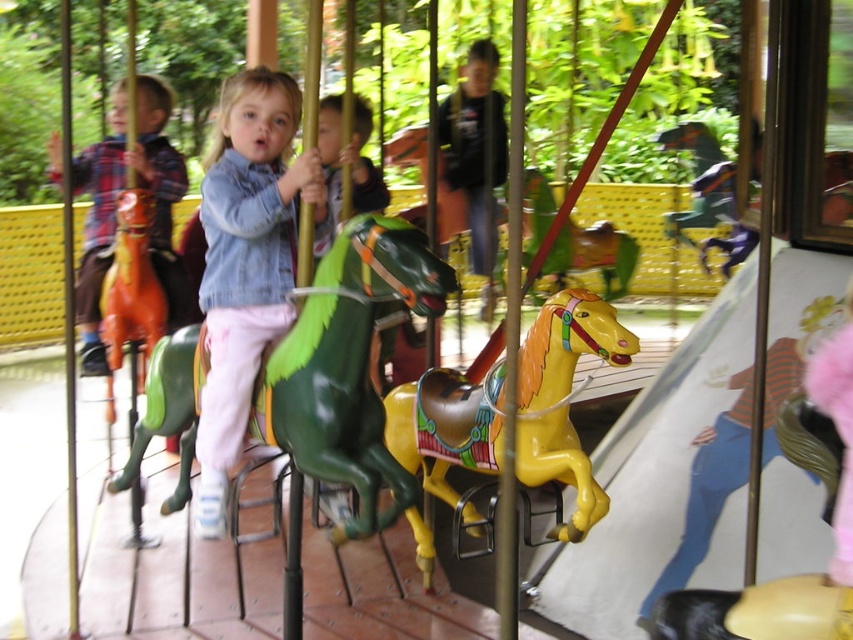
Between green glossy horse at center and matte plaid shirt at left, which one appears on the left side from the viewer's perspective?

From the viewer's perspective, matte plaid shirt at left appears more on the left side.

Based on the photo, who is higher up, green glossy horse at center or matte plaid shirt at left?

Positioned higher is matte plaid shirt at left.

Find the location of `green glossy horse at center`. green glossy horse at center is located at coordinates click(x=350, y=368).

Does matte plaid shirt at left appear over matte orange horse at left?

Indeed, matte plaid shirt at left is positioned over matte orange horse at left.

Who is more distant from viewer, (57, 156) or (132, 339)?

The point (57, 156) is more distant.

Where is `matte plaid shirt at left`? The height and width of the screenshot is (640, 853). matte plaid shirt at left is located at coordinates (114, 209).

Is shiny yellow horse at center bigger than matte orange horse at left?

Correct, shiny yellow horse at center is larger in size than matte orange horse at left.

Looking at this image, does shiny yellow horse at center appear over matte orange horse at left?

Incorrect, shiny yellow horse at center is not positioned above matte orange horse at left.

Where is `shiny yellow horse at center`? shiny yellow horse at center is located at coordinates (563, 397).